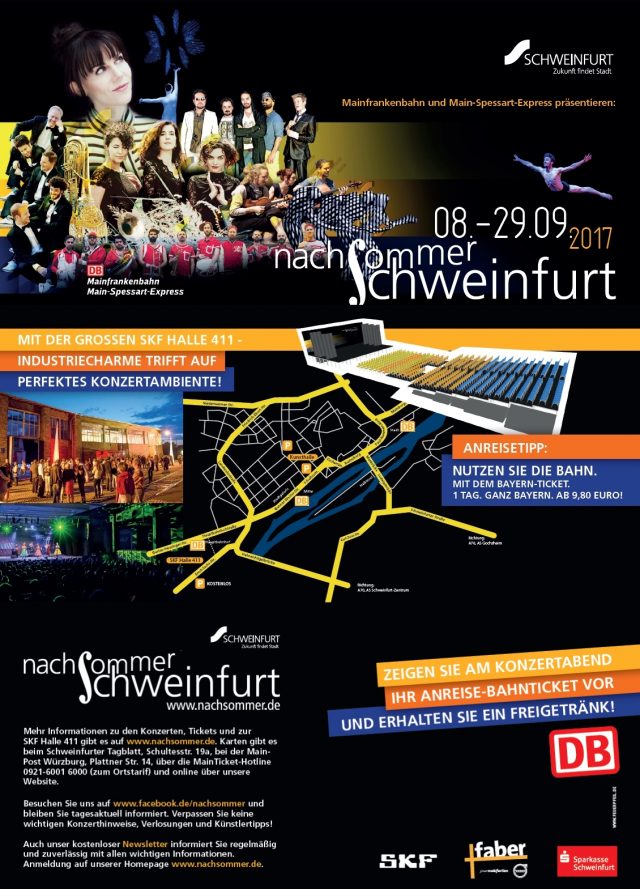
Identify the location of stage. Image resolution: width=640 pixels, height=889 pixels. (6, 557).